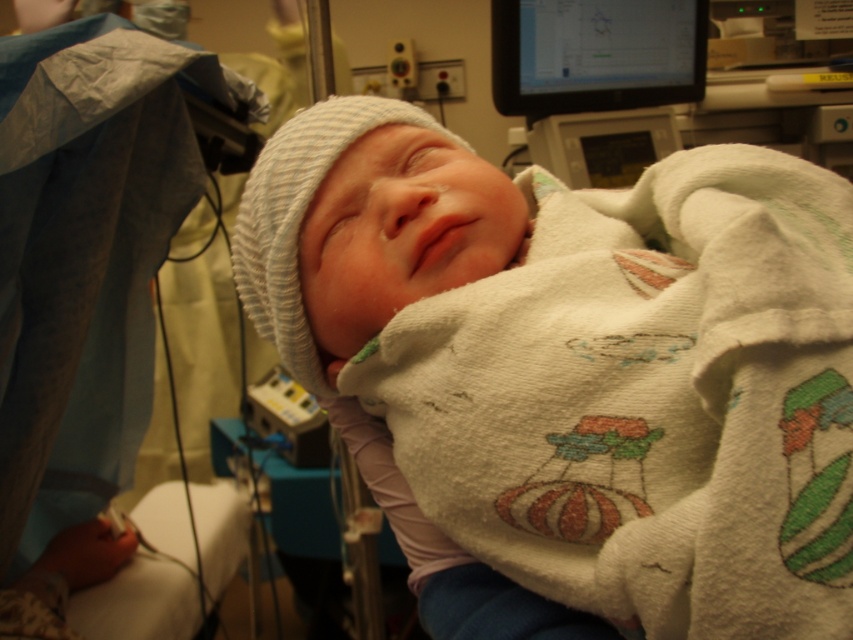
Can you confirm if white knit hat at center is taller than black glossy monitor at upper right?

Yes, white knit hat at center is taller than black glossy monitor at upper right.

Is white knit hat at center to the right of black glossy monitor at upper right from the viewer's perspective?

Incorrect, white knit hat at center is not on the right side of black glossy monitor at upper right.

Does point (425, 417) lie in front of point (534, 44)?

Yes, point (425, 417) is in front of point (534, 44).

Find the location of `white knit hat at center`. white knit hat at center is located at coordinates (575, 365).